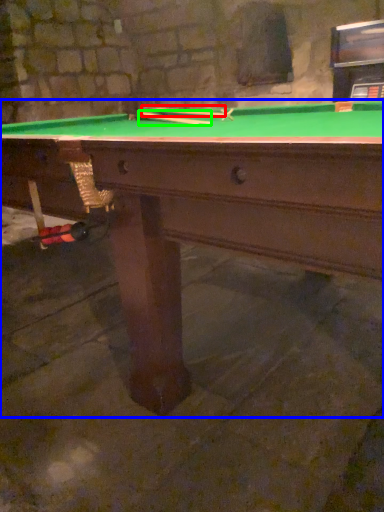
Question: Based on their relative distances, which object is nearer to cue (highlighted by a red box)? Choose from billiard table (highlighted by a blue box) and cue (highlighted by a green box).

Choices:
 (A) billiard table
 (B) cue

Answer: (B)